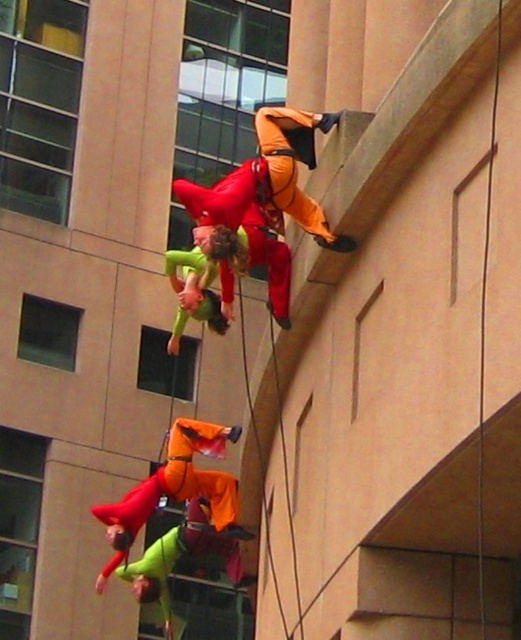
Based on the scene description, what color fabric is located at the coordinates point (184, 563)?

The fabric at point (184, 563) is neon green.

You are observing the performers in the scene and notice two points marked in the image. Which of the two points, point (226, 248) or point (177, 442), is closer to you?

Point (226, 248) is closer to the viewer than point (177, 442).